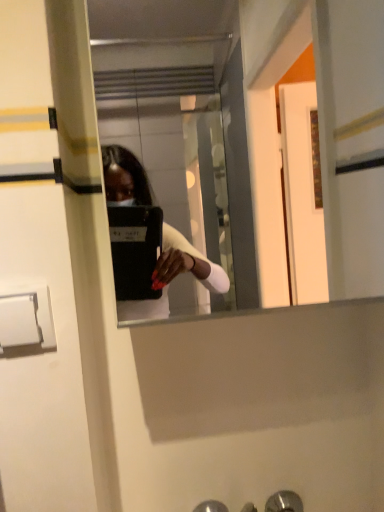
Question: Does point (11, 293) appear closer or farther from the camera than point (281, 495)?

Choices:
 (A) closer
 (B) farther

Answer: (A)

Question: In terms of size, does white plastic door handle at lower left, the 1th door handle from the left, appear bigger or smaller than metallic silver door handle at lower center, which is the second door handle in top-to-bottom order?

Choices:
 (A) small
 (B) big

Answer: (A)

Question: Which of these objects is positioned farthest from the clear glass mirror at center?

Choices:
 (A) white plastic door handle at lower left, which ranks as the 2th door handle in back-to-front order
 (B) metallic silver door handle at lower center, which is the second door handle in top-to-bottom order

Answer: (A)

Question: Which object is positioned closest to the metallic silver door handle at lower center, the 1th door handle in the back-to-front sequence?

Choices:
 (A) white plastic door handle at lower left, which ranks as the 2th door handle in back-to-front order
 (B) clear glass mirror at center

Answer: (A)